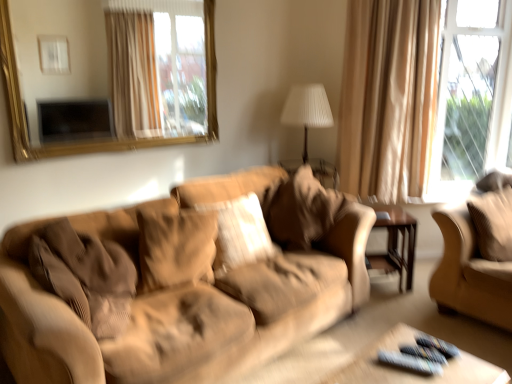
Question: Is suede-like beige pillow at center, which appears as the 3th pillow when viewed from the right, a part of corduroy pillow at right, the 4th pillow viewed from the left?

Choices:
 (A) yes
 (B) no

Answer: (B)

Question: Is corduroy pillow at right, arranged as the first pillow when viewed from the right, positioned far away from suede-like beige pillow at center, placed as the second pillow when sorted from left to right?

Choices:
 (A) no
 (B) yes

Answer: (B)

Question: Does corduroy pillow at right, the 4th pillow viewed from the left, have a lesser width compared to suede-like beige pillow at center, placed as the second pillow when sorted from left to right?

Choices:
 (A) yes
 (B) no

Answer: (A)

Question: Is corduroy pillow at right, the 4th pillow viewed from the left, smaller than suede-like beige pillow at center, which appears as the 3th pillow when viewed from the right?

Choices:
 (A) no
 (B) yes

Answer: (A)

Question: Does corduroy pillow at right, the 4th pillow viewed from the left, have a greater height compared to suede-like beige pillow at center, which appears as the 3th pillow when viewed from the right?

Choices:
 (A) yes
 (B) no

Answer: (A)

Question: In terms of width, does brown wood side table at center right look wider or thinner when compared to gold-framed mirror at upper left?

Choices:
 (A) thin
 (B) wide

Answer: (B)

Question: Would you say brown wood side table at center right is to the left or to the right of gold-framed mirror at upper left in the picture?

Choices:
 (A) left
 (B) right

Answer: (B)

Question: Do you think brown wood side table at center right is within gold-framed mirror at upper left, or outside of it?

Choices:
 (A) outside
 (B) inside

Answer: (A)

Question: From a real-world perspective, is brown wood side table at center right positioned above or below gold-framed mirror at upper left?

Choices:
 (A) above
 (B) below

Answer: (B)

Question: Is suede-like beige couch at right bigger or smaller than wooden remote control tray at lower right?

Choices:
 (A) small
 (B) big

Answer: (B)

Question: From a real-world perspective, is suede-like beige couch at right positioned above or below wooden remote control tray at lower right?

Choices:
 (A) below
 (B) above

Answer: (B)

Question: Would you say suede-like beige couch at right is to the left or to the right of wooden remote control tray at lower right in the picture?

Choices:
 (A) right
 (B) left

Answer: (A)

Question: Looking at their shapes, would you say suede-like beige couch at right is wider or thinner than wooden remote control tray at lower right?

Choices:
 (A) thin
 (B) wide

Answer: (B)

Question: From the image's perspective, is brown wood side table at center right positioned above or below white pleated fabric at center?

Choices:
 (A) below
 (B) above

Answer: (A)

Question: From a real-world perspective, relative to white pleated fabric at center, is brown wood side table at center right vertically above or below?

Choices:
 (A) above
 (B) below

Answer: (B)